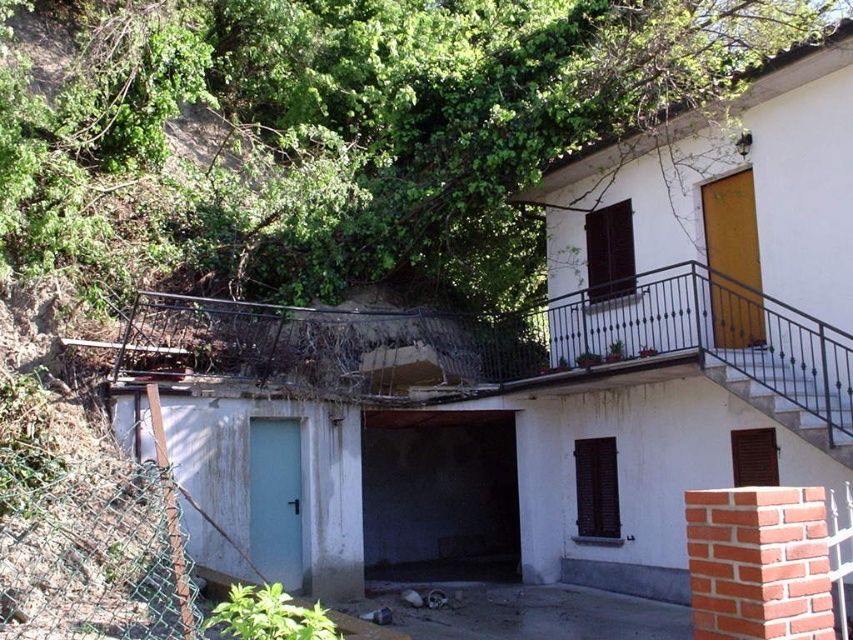
Question: Among these points, which one is farthest from the camera?

Choices:
 (A) (376, 26)
 (B) (722, 376)
 (C) (113, 515)

Answer: (A)

Question: Is green leafy tree at upper left below green chain-link fence at lower left?

Choices:
 (A) yes
 (B) no

Answer: (B)

Question: Which of these objects is positioned closest to the white painted wood stairs at center?

Choices:
 (A) green leafy tree at upper left
 (B) green chain-link fence at lower left

Answer: (B)

Question: Observing the image, what is the correct spatial positioning of green leafy tree at upper left in reference to green chain-link fence at lower left?

Choices:
 (A) right
 (B) left

Answer: (A)

Question: Does green leafy tree at upper left have a lesser width compared to green chain-link fence at lower left?

Choices:
 (A) no
 (B) yes

Answer: (A)

Question: Which point is closer to the camera?

Choices:
 (A) (347, 3)
 (B) (38, 499)

Answer: (B)